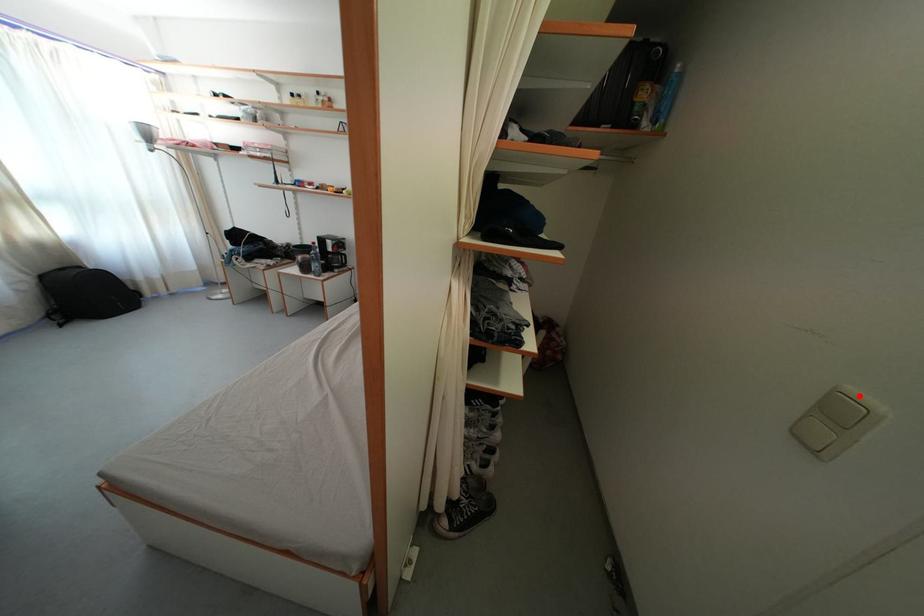
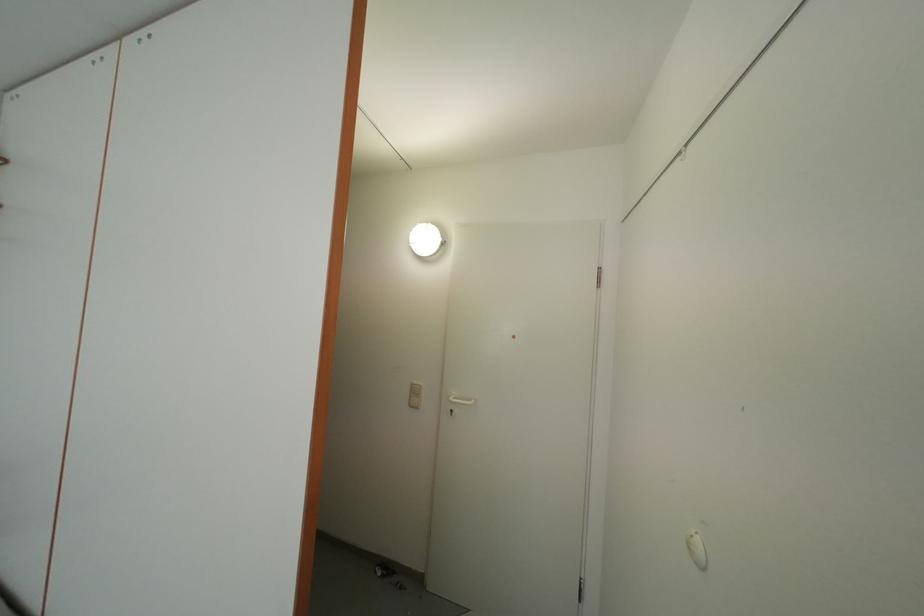
The point at the highlighted location is marked in the first image. Where is the corresponding point in the second image?

(420, 387)